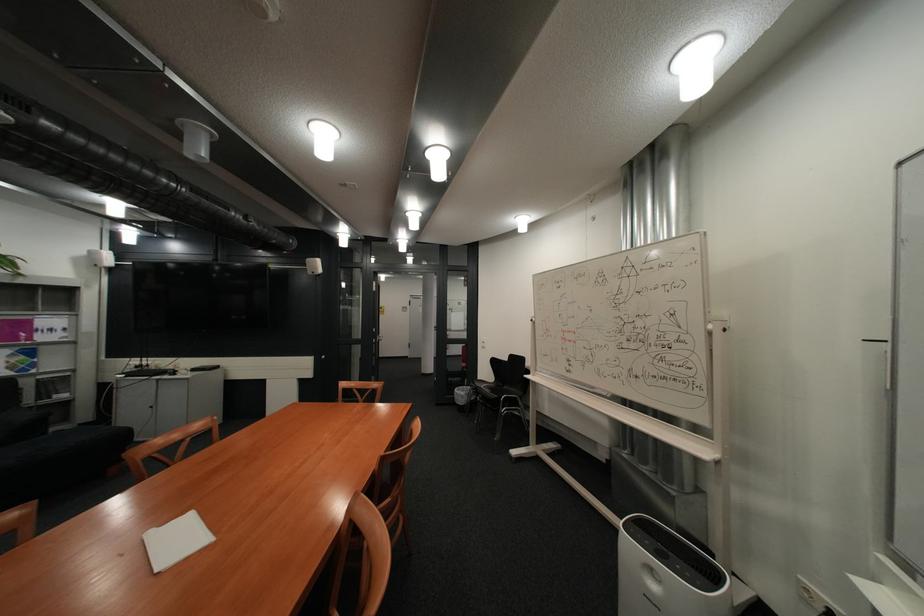
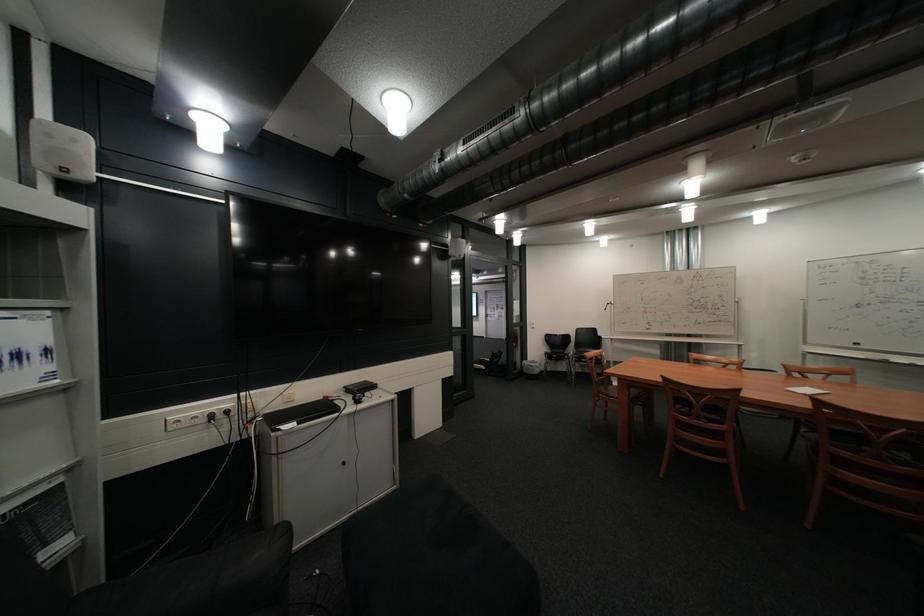
Locate, in the second image, the point that corresponds to the point at 55,377 in the first image.

(10, 514)